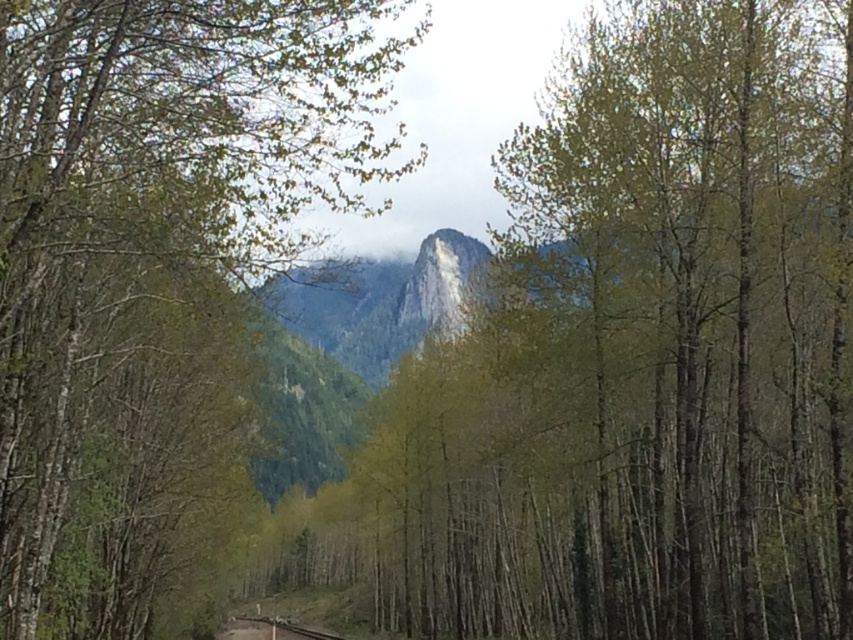
You are standing in the forest scene described. There is a green leafy tree at center represented by point (154,268). If you face the mountain in the background, which direction should you turn to find the green leafy tree at center?

Since the green leafy tree at center is represented by point (154,268), you should turn to the center direction to face it while facing the mountain.

You are a hiker standing at the lower center of the image, near the smooth metal train track at lower center. You want to walk to the green leafy tree at center. Is the path between them wide enough for you to pass through comfortably?

The green leafy tree at center might be wider than the smooth metal train track at lower center, so the path between them may not be wide enough for comfortable passage. It is recommended to check the actual width before proceeding.